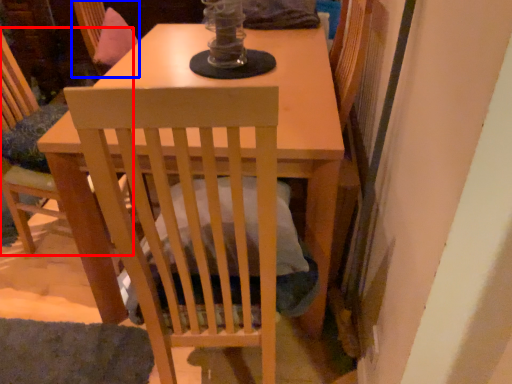
Question: Which point is further to the camera, chair (highlighted by a red box) or swivel chair (highlighted by a blue box)?

Choices:
 (A) chair
 (B) swivel chair

Answer: (B)